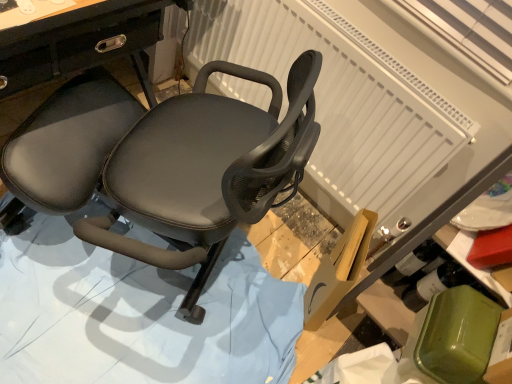
Describe the element at coordinates (341, 98) in the screenshot. The image size is (512, 384). I see `white textured radiator at upper center` at that location.

Locate an element on the screen. Image resolution: width=512 pixels, height=384 pixels. black leather chair at center is located at coordinates (139, 315).

Find the location of a particular element. This screenshot has height=384, width=512. white textured radiator at upper center is located at coordinates (341, 98).

Looking at this image, does matte black chair at center have a smaller size compared to black leather chair at center?

No, matte black chair at center is not smaller than black leather chair at center.

Is matte black chair at center with black leather chair at center?

No, matte black chair at center is not in contact with black leather chair at center.

From the image's perspective, which one is positioned higher, matte black chair at center or black leather chair at center?

matte black chair at center, from the image's perspective.

Which object is positioned more to the right, matte black chair at center or white textured radiator at upper center?

From the viewer's perspective, white textured radiator at upper center appears more on the right side.

Who is smaller, matte black chair at center or white textured radiator at upper center?

white textured radiator at upper center.

Can you confirm if matte black chair at center is taller than white textured radiator at upper center?

Yes.

Which is closer, (261, 29) or (203, 270)?

Point (261, 29) is farther from the camera than point (203, 270).

Does white textured radiator at upper center turn towards matte black chair at center?

Yes, white textured radiator at upper center is facing matte black chair at center.

From a real-world perspective, between white textured radiator at upper center and matte black chair at center, who is vertically lower?

From a 3D spatial view, matte black chair at center is below.

How far apart are white textured radiator at upper center and matte black chair at center?

A distance of 14.99 inches exists between white textured radiator at upper center and matte black chair at center.

Is black leather chair at center inside or outside of matte black chair at center?

black leather chair at center fits inside matte black chair at center.

Are black leather chair at center and matte black chair at center beside each other?

No, black leather chair at center is not beside matte black chair at center.

Is black leather chair at center aimed at matte black chair at center?

Yes, black leather chair at center is facing matte black chair at center.

From the image's perspective, is white textured radiator at upper center below black leather chair at center?

No, from the image's perspective, white textured radiator at upper center is not beneath black leather chair at center.

Which is more to the left, white textured radiator at upper center or black leather chair at center?

black leather chair at center.

Looking at this image, which is farther, (x=415, y=153) or (x=280, y=356)?

The point (x=280, y=356) is farther.

Between black leather chair at center and white textured radiator at upper center, which one is positioned in front?

black leather chair at center is in front.

Considering the relative sizes of black leather chair at center and white textured radiator at upper center in the image provided, is black leather chair at center bigger than white textured radiator at upper center?

Yes.

From the image's perspective, who appears lower, black leather chair at center or white textured radiator at upper center?

black leather chair at center appears lower in the image.

In the scene shown: Is black leather chair at center inside or outside of white textured radiator at upper center?

black leather chair at center lies outside white textured radiator at upper center.

Image resolution: width=512 pixels, height=384 pixels. I want to click on chair on the right of black leather chair at center, so (x=207, y=169).

Locate an element on the screen. This screenshot has height=384, width=512. radiator behind the matte black chair at center is located at coordinates (341, 98).

From the image, which object appears to be nearer to matte black chair at center, black leather chair at center or white textured radiator at upper center?

Based on the image, white textured radiator at upper center appears to be nearer to matte black chair at center.

Looking at the image, which one is located further to black leather chair at center, matte black chair at center or white textured radiator at upper center?

Based on the image, white textured radiator at upper center appears to be further to black leather chair at center.

From the image, which object appears to be nearer to black leather chair at center, white textured radiator at upper center or matte black chair at center?

matte black chair at center is closer to black leather chair at center.

From the image, which object appears to be farther from white textured radiator at upper center, black leather chair at center or matte black chair at center?

black leather chair at center is further to white textured radiator at upper center.

When comparing their distances from matte black chair at center, does white textured radiator at upper center or black leather chair at center seem further?

Based on the image, black leather chair at center appears to be further to matte black chair at center.

Estimate the real-world distances between objects in this image. Which object is closer to white textured radiator at upper center, matte black chair at center or black leather chair at center?

Based on the image, matte black chair at center appears to be nearer to white textured radiator at upper center.

This screenshot has width=512, height=384. In order to click on chair between white textured radiator at upper center and black leather chair at center from top to bottom in this screenshot , I will do `click(207, 169)`.